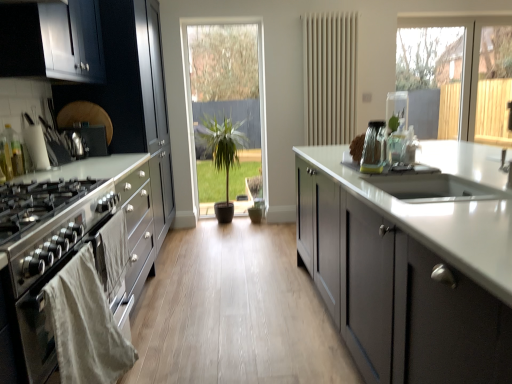
Question: In terms of width, does clear glass jars at right, which ranks as the first appliance in front-to-back order, look wider or thinner when compared to beige matte radiator at center?

Choices:
 (A) wide
 (B) thin

Answer: (B)

Question: Looking at the image, does clear glass jars at right, which ranks as the first appliance in front-to-back order, seem bigger or smaller compared to beige matte radiator at center?

Choices:
 (A) small
 (B) big

Answer: (A)

Question: Estimate the real-world distances between objects in this image. Which object is closer to the stainless steel oven at left?

Choices:
 (A) white cloth oven at left
 (B) clear glass jars at right, which ranks as the first appliance in front-to-back order
 (C) satin black cabinets at left, the first cabinetry positioned from the left
 (D) green matte plant at center
 (E) beige matte radiator at center

Answer: (A)

Question: Which is farther from the satin silver knife block at left, which appears as the 1th appliance when viewed from the left?

Choices:
 (A) matte gray cabinets at center, the 1th cabinetry when ordered from right to left
 (B) satin black cabinets at left, which ranks as the 2th cabinetry in right-to-left order
 (C) green matte plant at center
 (D) white cloth oven at left
 (E) stainless steel oven at left

Answer: (A)